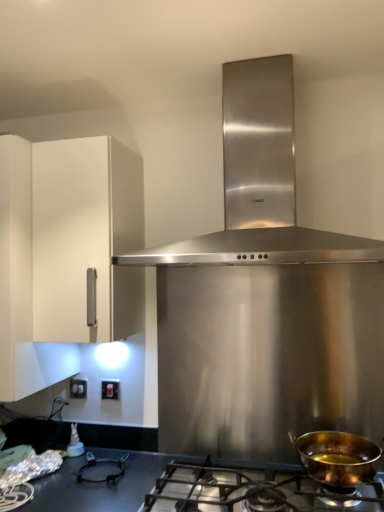
Question: From the image's perspective, is shiny copper pan at lower right on top of white plastic electric outlet at lower left, the second electric outlet in the right-to-left sequence?

Choices:
 (A) no
 (B) yes

Answer: (A)

Question: Is shiny copper pan at lower right not near white plastic electric outlet at lower left, which is the 1th electric outlet in back-to-front order?

Choices:
 (A) no
 (B) yes

Answer: (B)

Question: Is shiny copper pan at lower right taller than white plastic electric outlet at lower left, which is the second electric outlet from front to back?

Choices:
 (A) yes
 (B) no

Answer: (A)

Question: Can you confirm if shiny copper pan at lower right is shorter than white plastic electric outlet at lower left, the second electric outlet in the right-to-left sequence?

Choices:
 (A) yes
 (B) no

Answer: (B)

Question: Does shiny copper pan at lower right have a greater width compared to white plastic electric outlet at lower left, the second electric outlet in the right-to-left sequence?

Choices:
 (A) no
 (B) yes

Answer: (B)

Question: Is shiny copper pan at lower right beside white plastic electric outlet at lower left, which is the second electric outlet from front to back?

Choices:
 (A) no
 (B) yes

Answer: (A)

Question: Is white plastic electric outlet at lower left, which is the 1th electric outlet in back-to-front order, beside white matte cabinet at left?

Choices:
 (A) yes
 (B) no

Answer: (B)

Question: Can you confirm if white plastic electric outlet at lower left, which is the second electric outlet from front to back, is wider than white matte cabinet at left?

Choices:
 (A) no
 (B) yes

Answer: (A)

Question: Could you tell me if white plastic electric outlet at lower left, acting as the 1th electric outlet starting from the left, is turned towards white matte cabinet at left?

Choices:
 (A) yes
 (B) no

Answer: (B)

Question: Considering the relative positions of white plastic electric outlet at lower left, the second electric outlet in the right-to-left sequence, and white matte cabinet at left in the image provided, is white plastic electric outlet at lower left, the second electric outlet in the right-to-left sequence, to the right of white matte cabinet at left from the viewer's perspective?

Choices:
 (A) yes
 (B) no

Answer: (A)

Question: Is white plastic electric outlet at lower left, which is the second electric outlet from front to back, to the left of white matte cabinet at left from the viewer's perspective?

Choices:
 (A) yes
 (B) no

Answer: (B)

Question: Considering the relative sizes of white plastic electric outlet at lower left, which is the second electric outlet from front to back, and white matte cabinet at left in the image provided, is white plastic electric outlet at lower left, which is the second electric outlet from front to back, thinner than white matte cabinet at left?

Choices:
 (A) no
 (B) yes

Answer: (B)

Question: Is stainless steel range hood at center a part of shiny copper pan at lower right?

Choices:
 (A) yes
 (B) no

Answer: (B)